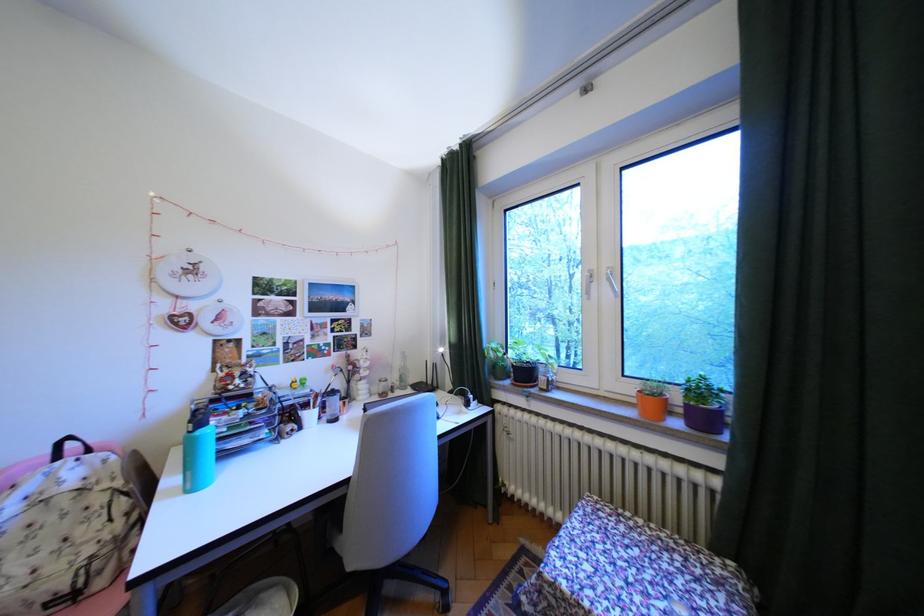
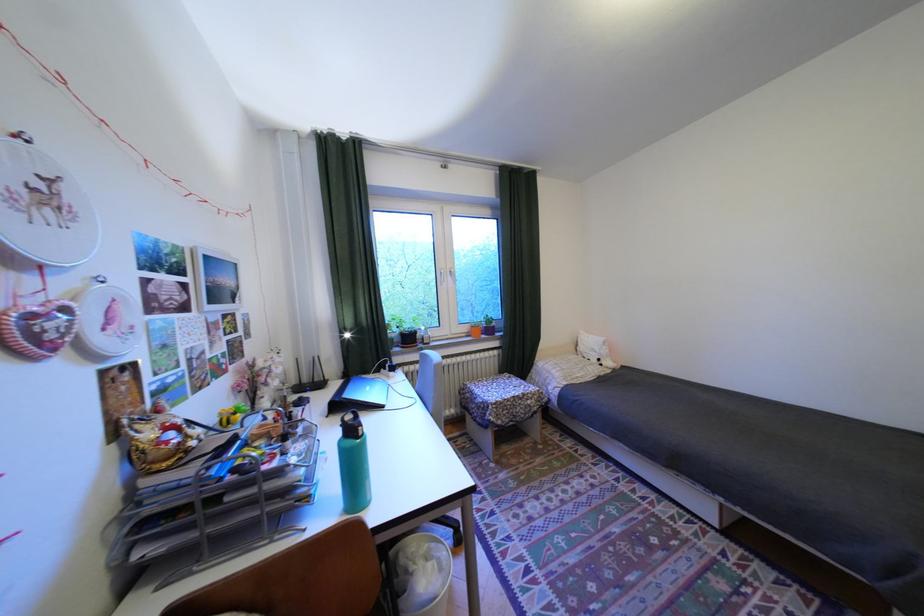
The point at (503, 344) is marked in the first image. Where is the corresponding point in the second image?

(397, 322)